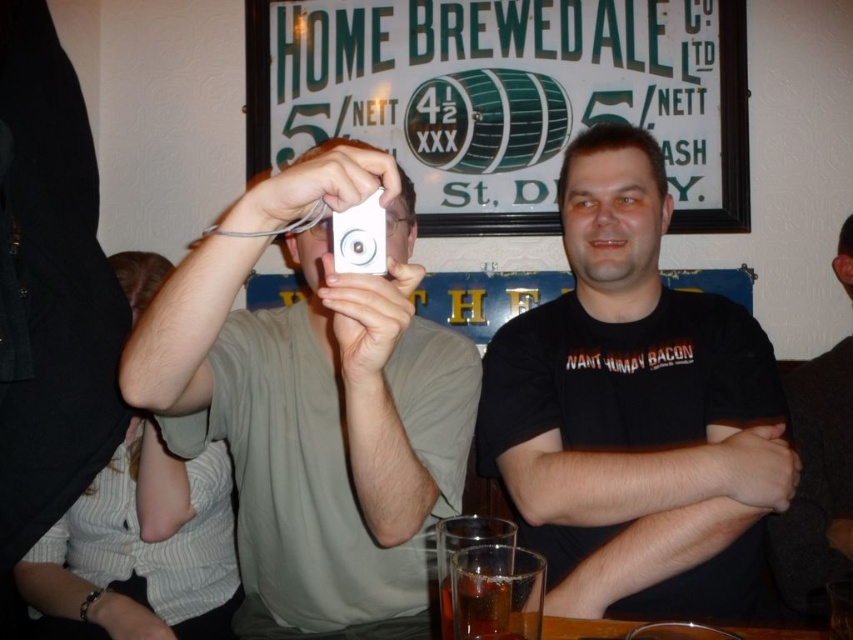
You are a photographer at the bar and see the two people. You need to take a photo of both of them using the white matte camera at center. However, there is a white plastic game controller at upper center in the way. Can you move the game controller to the right to get a clear shot?

The white matte camera at center is to the left of the white plastic game controller at upper center. Moving the game controller to the right would position it further away from the camera, potentially clearing the view for both individuals, allowing you to take the photo successfully.